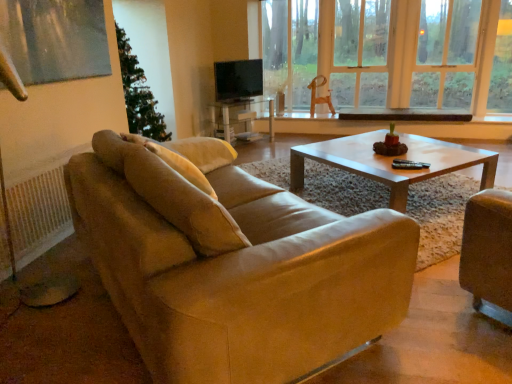
Question: Is transparent glass window at center to the left of matte glass coffee table at center from the viewer's perspective?

Choices:
 (A) yes
 (B) no

Answer: (B)

Question: Is transparent glass window at center positioned with its back to matte glass coffee table at center?

Choices:
 (A) no
 (B) yes

Answer: (A)

Question: Does transparent glass window at center turn towards matte glass coffee table at center?

Choices:
 (A) yes
 (B) no

Answer: (A)

Question: From the image's perspective, would you say transparent glass window at center is positioned over matte glass coffee table at center?

Choices:
 (A) no
 (B) yes

Answer: (B)

Question: Does transparent glass window at center have a lesser height compared to matte glass coffee table at center?

Choices:
 (A) no
 (B) yes

Answer: (A)

Question: Can you confirm if transparent glass window at center is positioned to the right of matte glass coffee table at center?

Choices:
 (A) yes
 (B) no

Answer: (A)

Question: Are matte glass coffee table at center and black plastic corded phone at center far apart?

Choices:
 (A) no
 (B) yes

Answer: (B)

Question: Can you confirm if matte glass coffee table at center is positioned to the left of black plastic corded phone at center?

Choices:
 (A) yes
 (B) no

Answer: (A)

Question: From the image's perspective, is matte glass coffee table at center located beneath black plastic corded phone at center?

Choices:
 (A) no
 (B) yes

Answer: (A)

Question: Considering the relative sizes of matte glass coffee table at center and black plastic corded phone at center in the image provided, is matte glass coffee table at center bigger than black plastic corded phone at center?

Choices:
 (A) yes
 (B) no

Answer: (A)

Question: Is black plastic corded phone at center surrounded by matte glass coffee table at center?

Choices:
 (A) yes
 (B) no

Answer: (B)

Question: Are matte glass coffee table at center and black plastic corded phone at center beside each other?

Choices:
 (A) no
 (B) yes

Answer: (A)

Question: Are matte black tv at center and beige fabric pillow at upper left making contact?

Choices:
 (A) yes
 (B) no

Answer: (B)